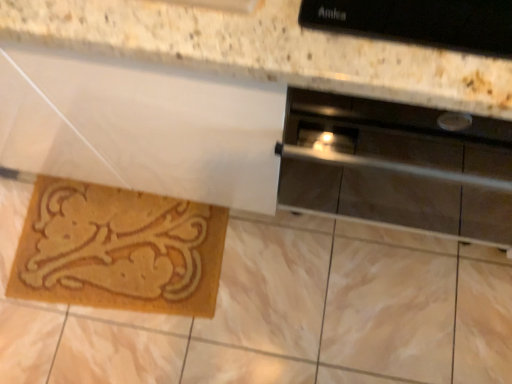
Question: Is stainless steel oven at right in front of or behind natural fiber mat at lower left in the image?

Choices:
 (A) behind
 (B) front

Answer: (B)

Question: Is stainless steel oven at right taller or shorter than natural fiber mat at lower left?

Choices:
 (A) tall
 (B) short

Answer: (A)

Question: In terms of size, does stainless steel oven at right appear bigger or smaller than natural fiber mat at lower left?

Choices:
 (A) small
 (B) big

Answer: (B)

Question: Considering the positions of natural fiber mat at lower left and stainless steel oven at right in the image, is natural fiber mat at lower left wider or thinner than stainless steel oven at right?

Choices:
 (A) wide
 (B) thin

Answer: (B)

Question: From the image's perspective, is natural fiber mat at lower left above or below stainless steel oven at right?

Choices:
 (A) above
 (B) below

Answer: (B)

Question: From a real-world perspective, relative to stainless steel oven at right, is natural fiber mat at lower left vertically above or below?

Choices:
 (A) above
 (B) below

Answer: (B)

Question: Considering the positions of natural fiber mat at lower left and stainless steel oven at right in the image, is natural fiber mat at lower left bigger or smaller than stainless steel oven at right?

Choices:
 (A) small
 (B) big

Answer: (A)